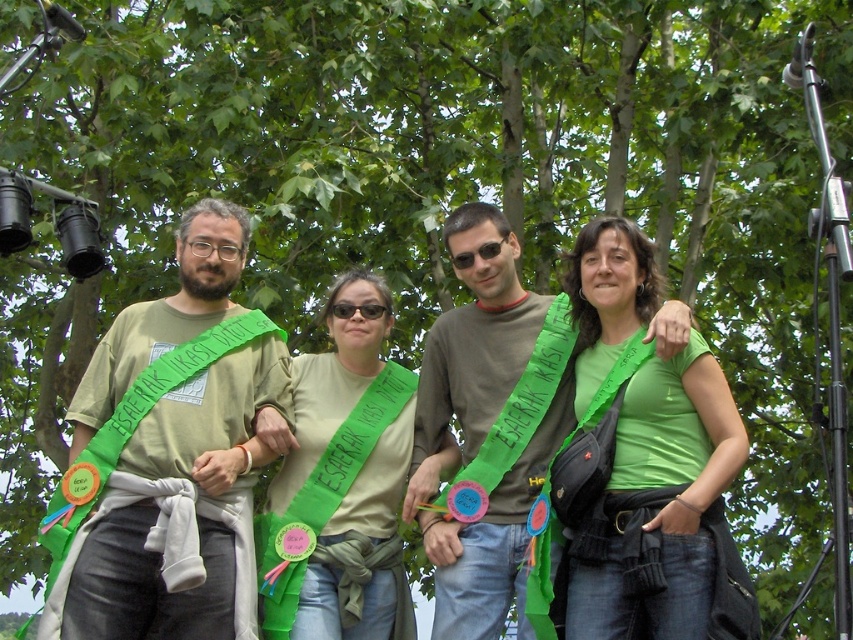
You are standing in front of the group of four individuals at the event. You notice two points marked on the image at coordinates point (657,442) and point (380,452). Which of these points is closer to you?

Point (657,442) is closer to the camera than point (380,452).

Based on the photo, you are standing at the center of the image and want to know what is located at the specific coordinate point mentioned. What object is exactly at the point labeled as point (645, 465)?

The green matte shirt at center is exactly at point (645, 465).

Consider the image. You are a photographer trying to capture a photo of the two points mentioned in the scene. Which point, point (154, 614) or point (576, 387), is closer to your camera lens?

Point (154, 614) is closer to the viewer than point (576, 387), so it is closer to the camera lens.